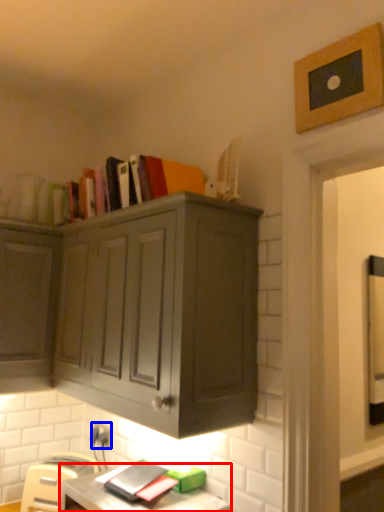
Question: Among these objects, which one is nearest to the camera, computer desk (highlighted by a red box) or electric outlet (highlighted by a blue box)?

Choices:
 (A) computer desk
 (B) electric outlet

Answer: (A)